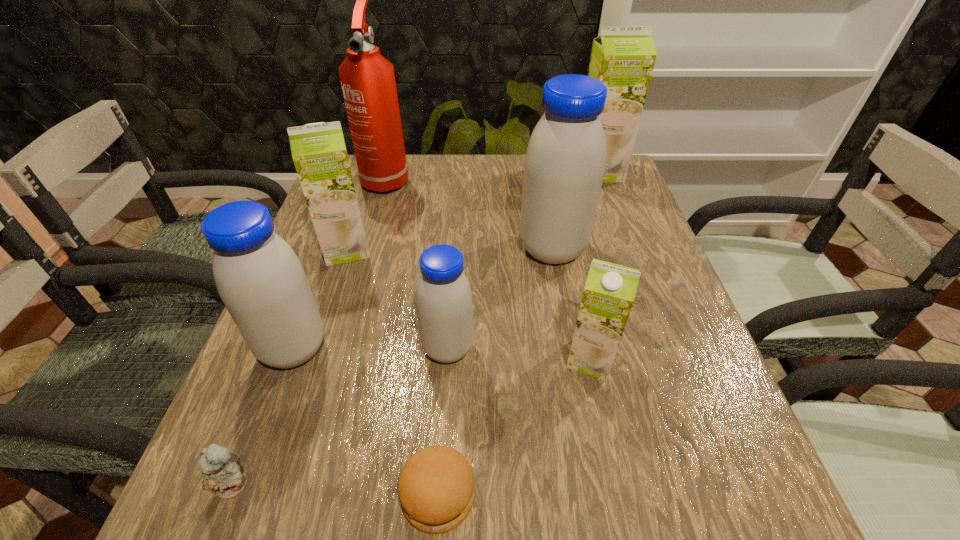
At what (x,y) coordinates should I click in order to perform the action: click on the second blue soya milk from left to right. Please return your answer as a coordinate pair (x, y). Looking at the image, I should click on (443, 297).

Locate an element on the screen. the fourth soya milk from right to left is located at coordinates (443, 297).

I want to click on blue teddy bear, so click(x=219, y=474).

Locate an element on the screen. This screenshot has height=540, width=960. teddy bear is located at coordinates (219, 474).

Where is `brown hamburger`? The height and width of the screenshot is (540, 960). brown hamburger is located at coordinates (436, 490).

The width and height of the screenshot is (960, 540). Find the location of `the shortest object`. the shortest object is located at coordinates (436, 490).

Find the location of `free space located at the nozzle of the fire extinguisher`. free space located at the nozzle of the fire extinguisher is located at coordinates (372, 227).

Locate an element on the screen. This screenshot has width=960, height=540. free spot located 0.110m on the front of the rightmost green soya milk is located at coordinates (612, 206).

Locate an element on the screen. vacant space located 0.080m on the back of the farthest blue soya milk is located at coordinates (545, 210).

Find the location of a particular element. The height and width of the screenshot is (540, 960). free space located 0.280m on the right of the leftmost green soya milk is located at coordinates click(494, 248).